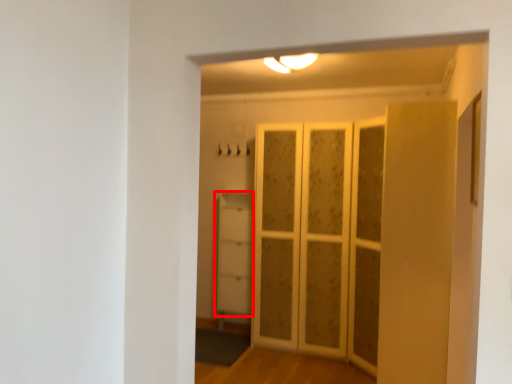
Question: From the image's perspective, what is the correct spatial positioning of cupboard (annotated by the red box) in reference to screen door?

Choices:
 (A) below
 (B) above

Answer: (A)